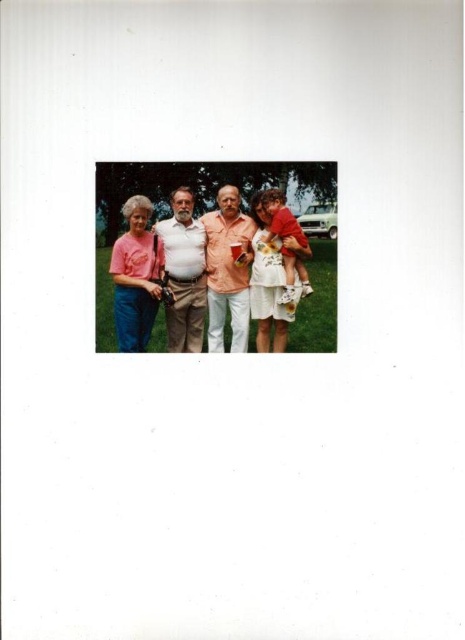
You are standing in the background of the image and want to move towards the camera. Which point, point (121, 276) or point (273, 237), is closer to your current position?

Point (121, 276) is closer to the camera than point (273, 237), so it is closer to your current position in the background.